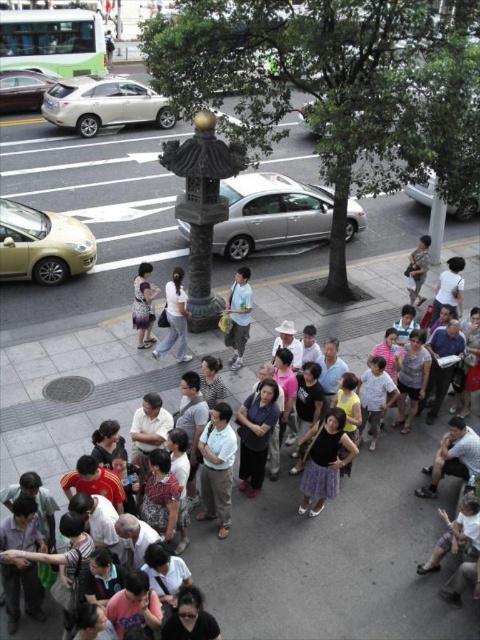
Does gray concrete pavement at lower center have a larger size compared to light blue jeans at center?

Indeed, gray concrete pavement at lower center has a larger size compared to light blue jeans at center.

Can you confirm if gray concrete pavement at lower center is shorter than light blue jeans at center?

In fact, gray concrete pavement at lower center may be taller than light blue jeans at center.

Locate an element on the screen. The image size is (480, 640). gray concrete pavement at lower center is located at coordinates (331, 556).

This screenshot has width=480, height=640. Find the location of `gray concrete pavement at lower center`. gray concrete pavement at lower center is located at coordinates (331, 556).

Which is above, light blue jeans at center or matte black dress at center?

matte black dress at center is higher up.

Does light blue jeans at center have a lesser width compared to matte black dress at center?

No, light blue jeans at center is not thinner than matte black dress at center.

Is point (187, 300) more distant than point (140, 288)?

Yes, it is behind point (140, 288).

Identify the location of light blue jeans at center. This screenshot has width=480, height=640. (175, 317).

Which is behind, point (355, 506) or point (242, 326)?

The point (242, 326) is behind.

Can you confirm if gray concrete pavement at lower center is positioned below light blue shirt at center?

Yes.

Is point (192, 532) positioned before point (229, 292)?

Yes, it is.

The width and height of the screenshot is (480, 640). I want to click on gray concrete pavement at lower center, so click(331, 556).